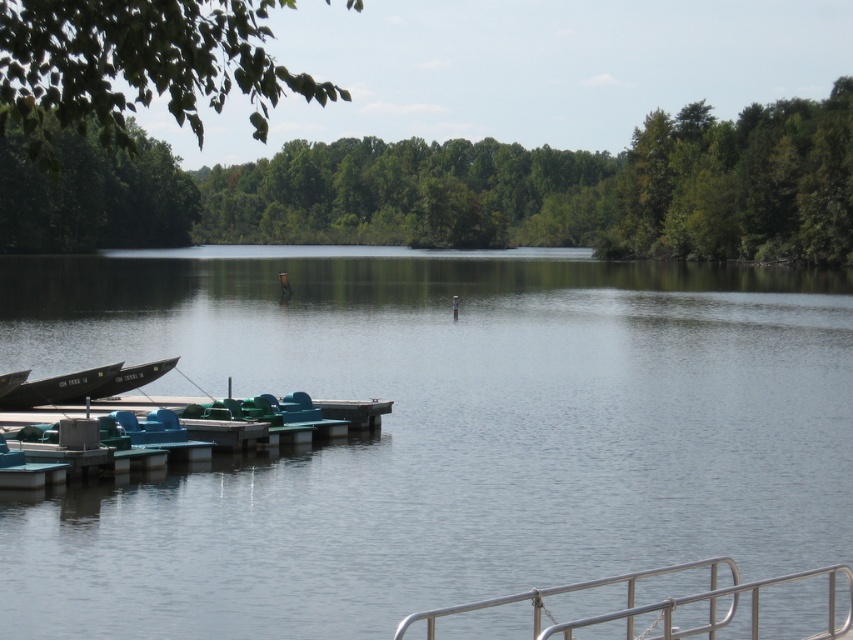
Question: Which point appears closest to the camera in this image?

Choices:
 (A) (49, 17)
 (B) (691, 566)
 (C) (73, 144)

Answer: (A)

Question: Is green leafy branch at upper left below silver metallic railing at lower right?

Choices:
 (A) no
 (B) yes

Answer: (A)

Question: Which point is farther to the camera?

Choices:
 (A) (352, 428)
 (B) (625, 188)
 (C) (90, 65)

Answer: (B)

Question: Does clear water at center have a greater width compared to green leafy branch at upper left?

Choices:
 (A) no
 (B) yes

Answer: (B)

Question: Is green leafy tree at center wider than green leafy branch at upper left?

Choices:
 (A) no
 (B) yes

Answer: (B)

Question: Estimate the real-world distances between objects in this image. Which object is closer to the green leafy tree at center?

Choices:
 (A) teal plastic boats at lower left
 (B) green leafy branch at upper left

Answer: (B)